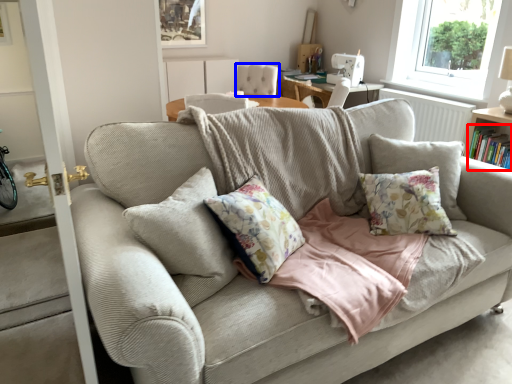
Question: Which point is further to the camera, book (highlighted by a red box) or armchair (highlighted by a blue box)?

Choices:
 (A) book
 (B) armchair

Answer: (B)